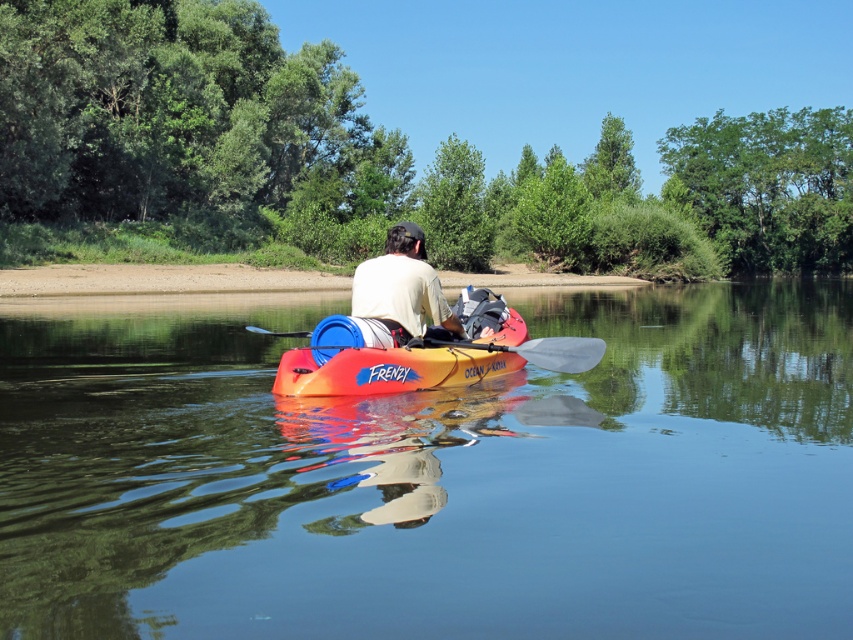
You are standing on the riverbank and see two points in the river. The first point is labeled as point (381, 257) and the second is labeled as point (310, 332). Which point is closer to you?

Point (381, 257) is further to the viewer than point (310, 332), so the point closer to you is point (310, 332).